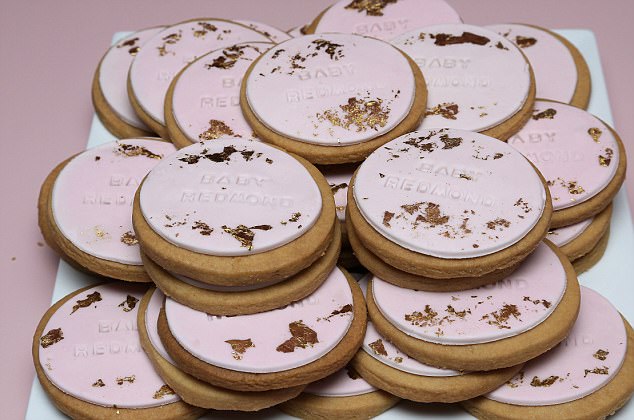
Where is `pink box`? pink box is located at coordinates tap(44, 94), tap(29, 314), tap(533, 13), tap(623, 103), tap(229, 12).